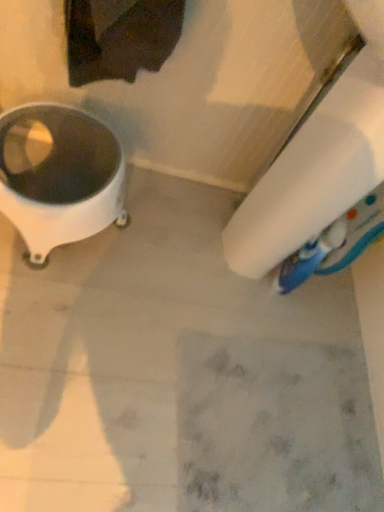
The width and height of the screenshot is (384, 512). I want to click on free space in front of white glossy toilet paper at lower right, so click(x=167, y=383).